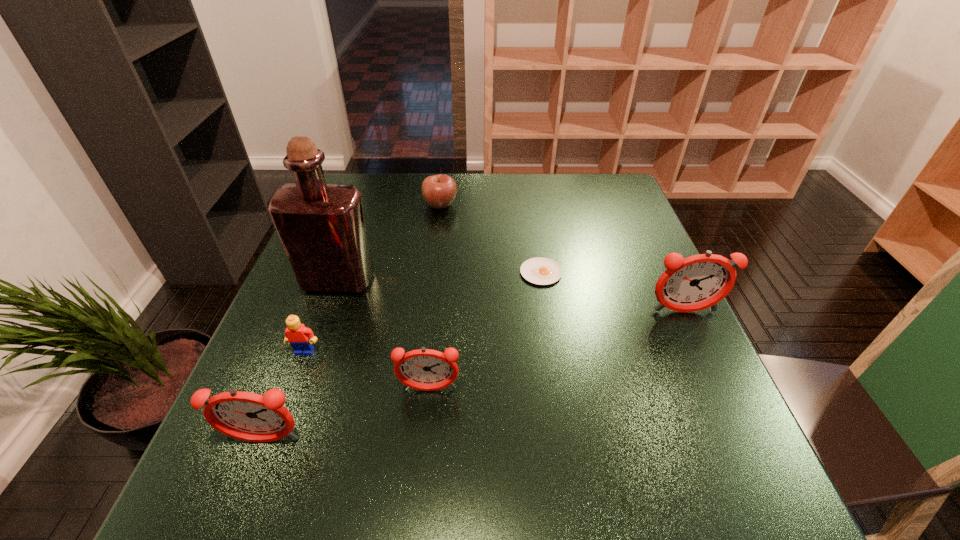
Find the location of a particular element. The width and height of the screenshot is (960, 540). object located in the near edge section of the desktop is located at coordinates (247, 416).

Identify the location of alarm clock that is at the left edge. The width and height of the screenshot is (960, 540). (247, 416).

Where is `liquor that is at the left edge`? This screenshot has width=960, height=540. liquor that is at the left edge is located at coordinates (321, 226).

In order to click on Lego positioned at the left edge in this screenshot , I will do `click(301, 338)`.

In order to click on object that is at the right edge in this screenshot , I will do `click(691, 284)`.

Locate an element on the screen. The height and width of the screenshot is (540, 960). object situated at the near left corner is located at coordinates (247, 416).

Find the location of a particular element. The height and width of the screenshot is (540, 960). vacant space at the far edge is located at coordinates (550, 212).

You are a GUI agent. You are given a task and a screenshot of the screen. Output one action in this format:
    pyautogui.click(x=<x>, y=<y>)
    Task: Click on the vacant space at the near edge of the desktop
    Image resolution: width=960 pixels, height=540 pixels.
    Given the screenshot: What is the action you would take?
    pyautogui.click(x=516, y=448)

I want to click on vacant point at the right edge, so click(x=680, y=381).

The width and height of the screenshot is (960, 540). Identify the location of vacant region at the far left corner of the desktop. (357, 180).